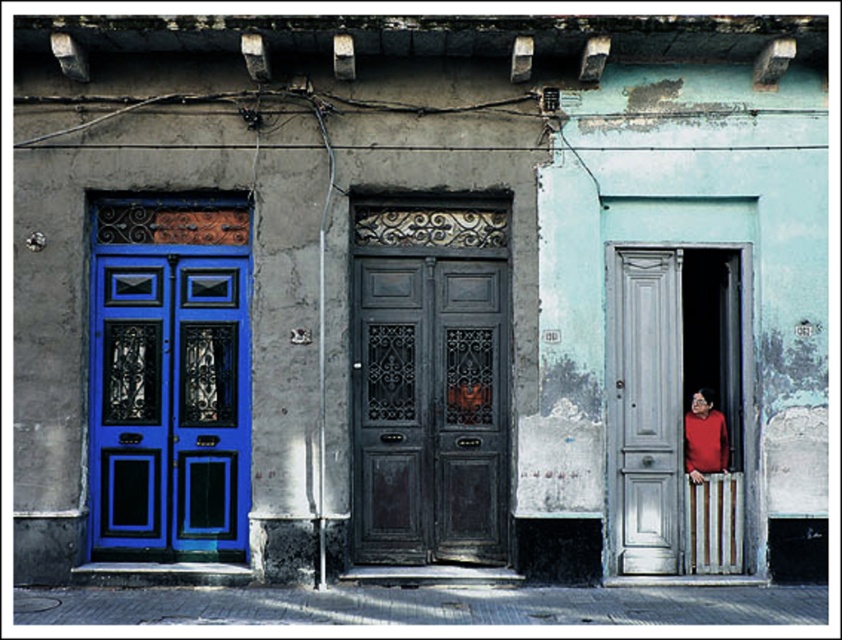
Is point (222, 509) positioned after point (706, 435)?

No, it is in front of (706, 435).

Who is higher up, shiny blue door at left or matte red shirt at right?

shiny blue door at left is higher up.

What do you see at coordinates (169, 404) in the screenshot?
I see `shiny blue door at left` at bounding box center [169, 404].

You are a GUI agent. You are given a task and a screenshot of the screen. Output one action in this format:
    pyautogui.click(x=<x>, y=<y>)
    Task: Click on the shiny blue door at left
    The height and width of the screenshot is (640, 842).
    Given the screenshot: What is the action you would take?
    pyautogui.click(x=169, y=404)

Does point (496, 429) lie in front of point (232, 449)?

No, (496, 429) is behind (232, 449).

Does dark wood/wooden door at center have a larger size compared to shiny blue door at left?

Indeed, dark wood/wooden door at center has a larger size compared to shiny blue door at left.

This screenshot has height=640, width=842. What do you see at coordinates (429, 410) in the screenshot? I see `dark wood/wooden door at center` at bounding box center [429, 410].

The image size is (842, 640). Identify the location of dark wood/wooden door at center. (429, 410).

Is dark wood/wooden door at center smaller than matte red shirt at right?

Incorrect, dark wood/wooden door at center is not smaller in size than matte red shirt at right.

From the picture: Who is positioned more to the right, dark wood/wooden door at center or matte red shirt at right?

matte red shirt at right is more to the right.

You are a GUI agent. You are given a task and a screenshot of the screen. Output one action in this format:
    pyautogui.click(x=<x>, y=<y>)
    Task: Click on the dark wood/wooden door at center
    This screenshot has height=640, width=842.
    Given the screenshot: What is the action you would take?
    pyautogui.click(x=429, y=410)